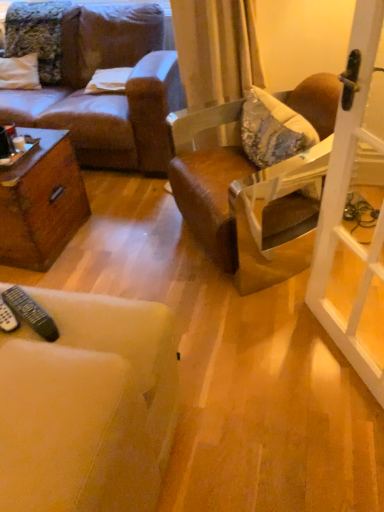
Question: Does white glass screen door at right come behind black plastic remote control at lower left, which is counted as the first remote control, starting from the left?

Choices:
 (A) no
 (B) yes

Answer: (A)

Question: Is white glass screen door at right at the right side of black plastic remote control at lower left, which is counted as the first remote control, starting from the left?

Choices:
 (A) no
 (B) yes

Answer: (B)

Question: Considering the relative sizes of white glass screen door at right and black plastic remote control at lower left, the second remote control in the right-to-left sequence, in the image provided, is white glass screen door at right taller than black plastic remote control at lower left, the second remote control in the right-to-left sequence,?

Choices:
 (A) no
 (B) yes

Answer: (B)

Question: Considering the relative sizes of white glass screen door at right and black plastic remote control at lower left, which is counted as the first remote control, starting from the left, in the image provided, is white glass screen door at right wider than black plastic remote control at lower left, which is counted as the first remote control, starting from the left,?

Choices:
 (A) yes
 (B) no

Answer: (B)

Question: From a real-world perspective, is white glass screen door at right below black plastic remote control at lower left, which is counted as the first remote control, starting from the left?

Choices:
 (A) no
 (B) yes

Answer: (A)

Question: Is white glass screen door at right in front of black plastic remote control at lower left, the second remote control in the right-to-left sequence?

Choices:
 (A) no
 (B) yes

Answer: (B)

Question: Does black plastic remote at lower left, which ranks as the second remote control in left-to-right order, come in front of brown leather chair at center?

Choices:
 (A) yes
 (B) no

Answer: (A)

Question: Can you confirm if black plastic remote at lower left, arranged as the first remote control when viewed from the right, is wider than brown leather chair at center?

Choices:
 (A) no
 (B) yes

Answer: (A)

Question: Does black plastic remote at lower left, arranged as the first remote control when viewed from the right, appear on the left side of brown leather chair at center?

Choices:
 (A) yes
 (B) no

Answer: (A)

Question: Could you tell me if black plastic remote at lower left, arranged as the first remote control when viewed from the right, is facing brown leather chair at center?

Choices:
 (A) yes
 (B) no

Answer: (B)

Question: Is black plastic remote at lower left, which ranks as the second remote control in left-to-right order, far away from brown leather chair at center?

Choices:
 (A) no
 (B) yes

Answer: (B)

Question: Is black plastic remote at lower left, arranged as the first remote control when viewed from the right, located outside brown leather chair at center?

Choices:
 (A) no
 (B) yes

Answer: (B)

Question: Are brown leather chair at center and white fabric pillow at upper center far apart?

Choices:
 (A) yes
 (B) no

Answer: (A)